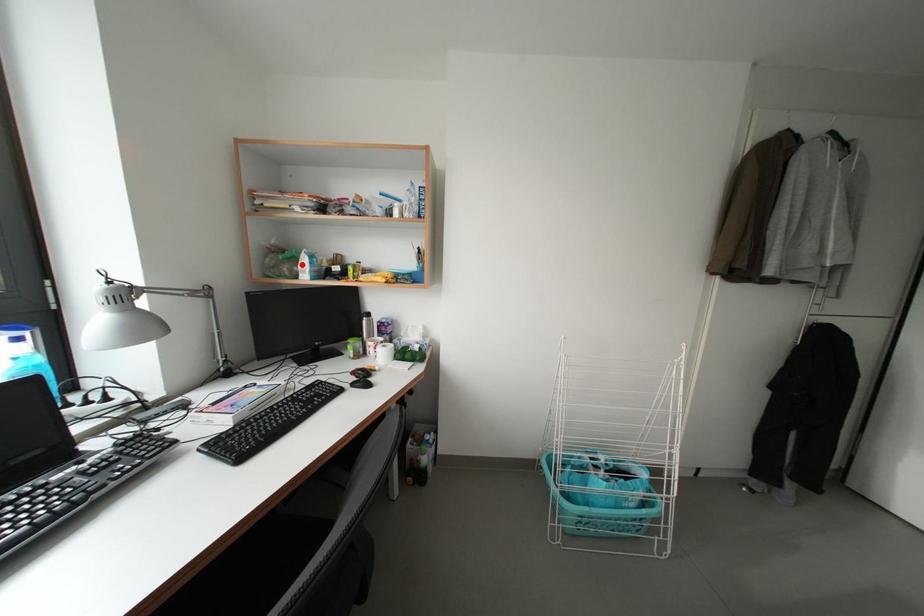
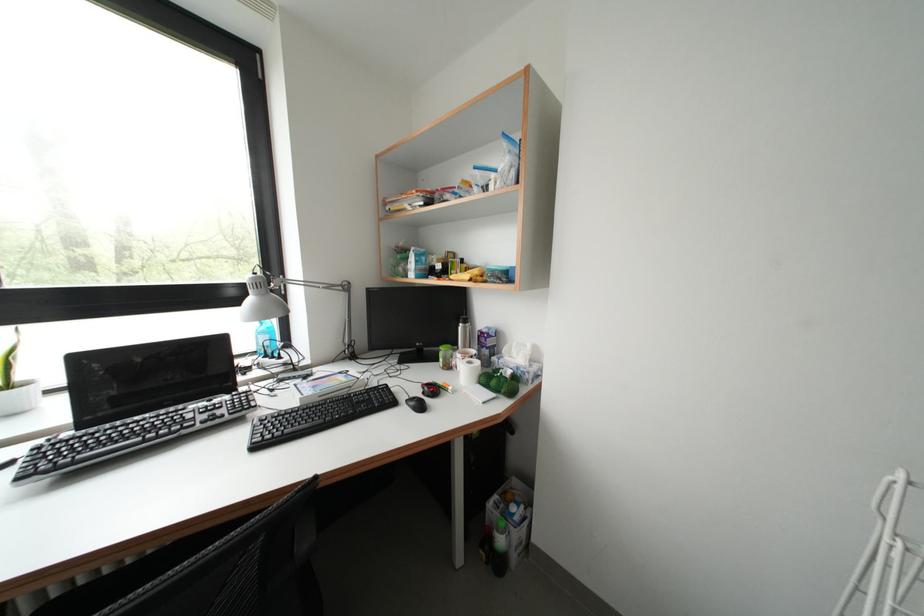
Find the pixel in the second image that matches the highlighted location in the first image.

(415, 264)